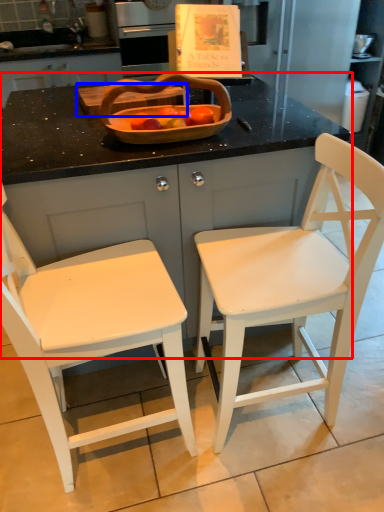
Question: Which of the following is the farthest to the observer, counter (highlighted by a red box) or cutting board (highlighted by a blue box)?

Choices:
 (A) counter
 (B) cutting board

Answer: (B)